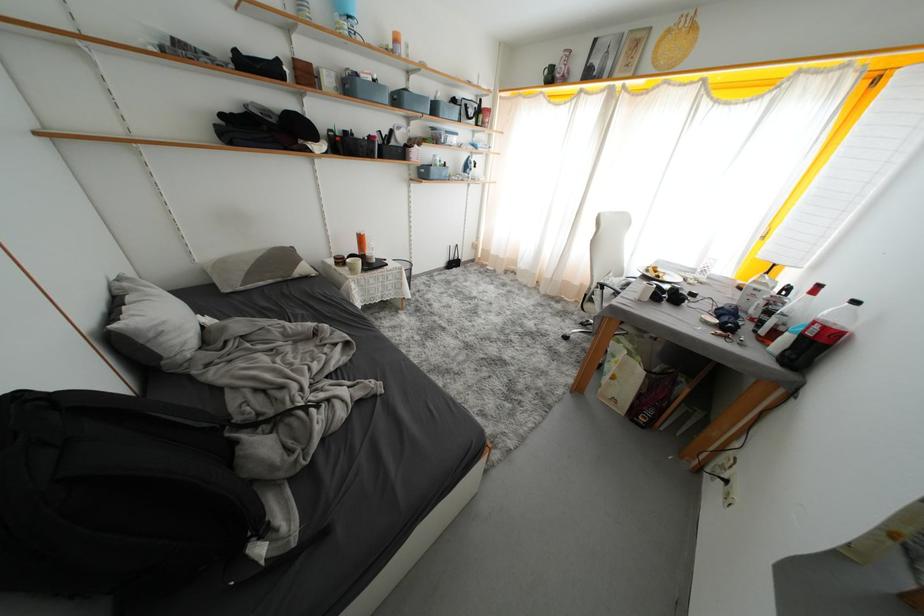
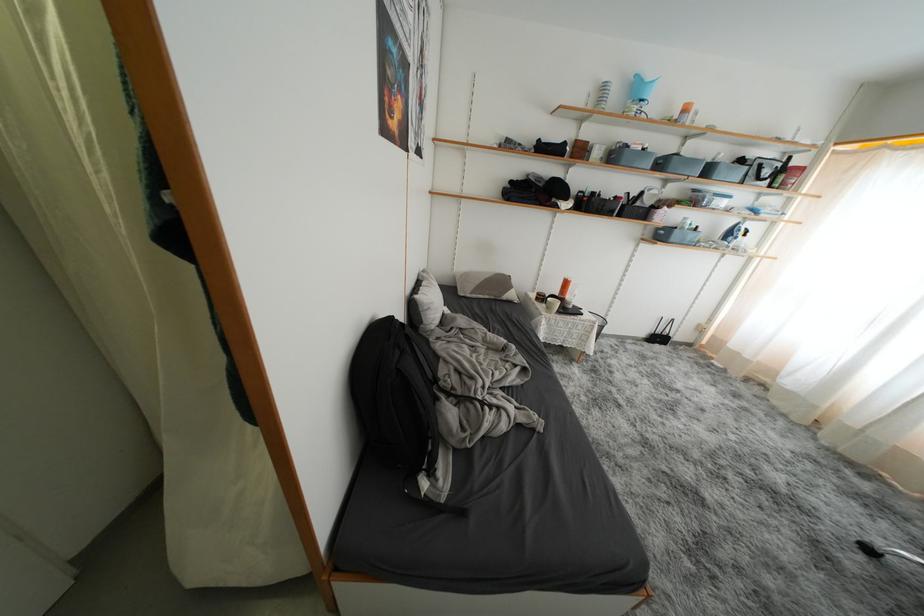
In the second image, find the point that corresponds to pixel 293 261 in the first image.

(508, 286)